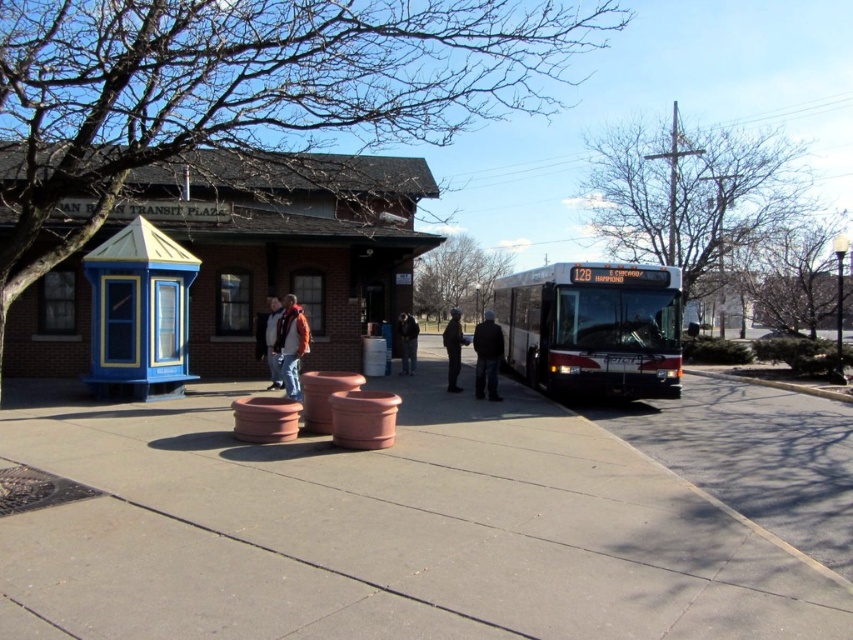
Question: Which point is farther from the camera taking this photo?

Choices:
 (A) (206, 541)
 (B) (410, 321)
 (C) (291, 388)
 (D) (276, 364)

Answer: (B)

Question: Does dark blue jeans at center have a lesser width compared to matte black jacket at center?

Choices:
 (A) no
 (B) yes

Answer: (A)

Question: Which object is closer to the camera taking this photo?

Choices:
 (A) matte black jacket at center
 (B) blue painted booth at left
 (C) dark gray jacket at center

Answer: (B)

Question: Can you confirm if concrete at center is bigger than orange jacket at center?

Choices:
 (A) no
 (B) yes

Answer: (B)

Question: Which object is closer to the camera taking this photo?

Choices:
 (A) concrete at center
 (B) dark gray jacket at center
 (C) dark blue jeans at center

Answer: (A)

Question: Is the position of dark blue jeans at center more distant than that of dark gray jacket at center?

Choices:
 (A) no
 (B) yes

Answer: (A)